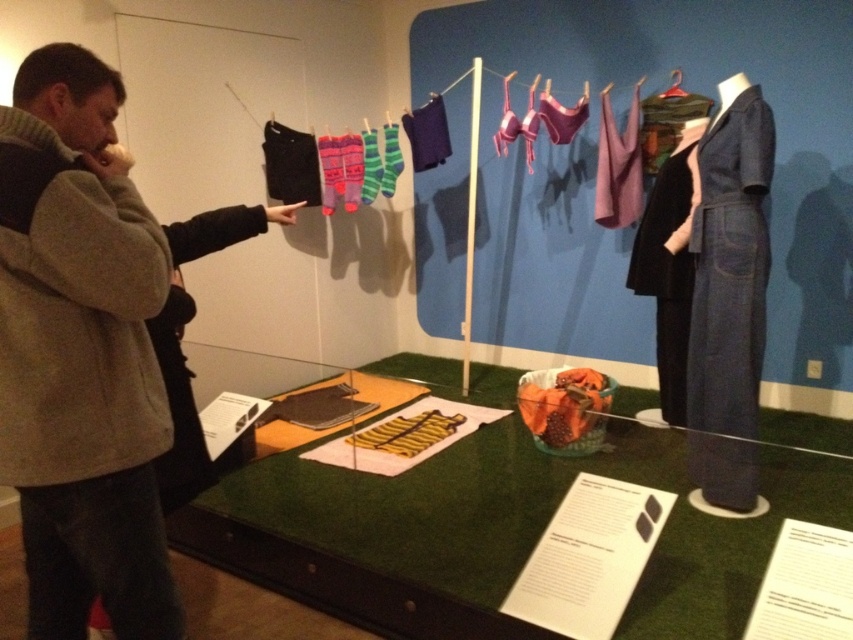
You are standing in front of the indoor display setup. You see a point marked at coordinates (x=496, y=529). What does this point correspond to in the scene?

The point at coordinates (x=496, y=529) corresponds to the green felt table at center.

You are a visitor at the exhibition and want to take a photo of both the green felt table at center and the black matte suit at right. Your camera has a maximum focus range of 35 inches. Can you capture both objects in focus without moving your position?

The green felt table at center is 34.83 inches away from the black matte suit at right. Since the distance between them is within the camera maximum focus range of 35 inches, you can capture both objects in focus without moving your position.